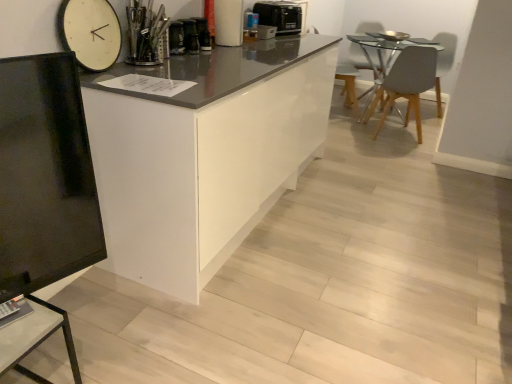
Where is `vacant area that lies between gray matte chair at right and white glossy cabinet at center`? vacant area that lies between gray matte chair at right and white glossy cabinet at center is located at coordinates (336, 178).